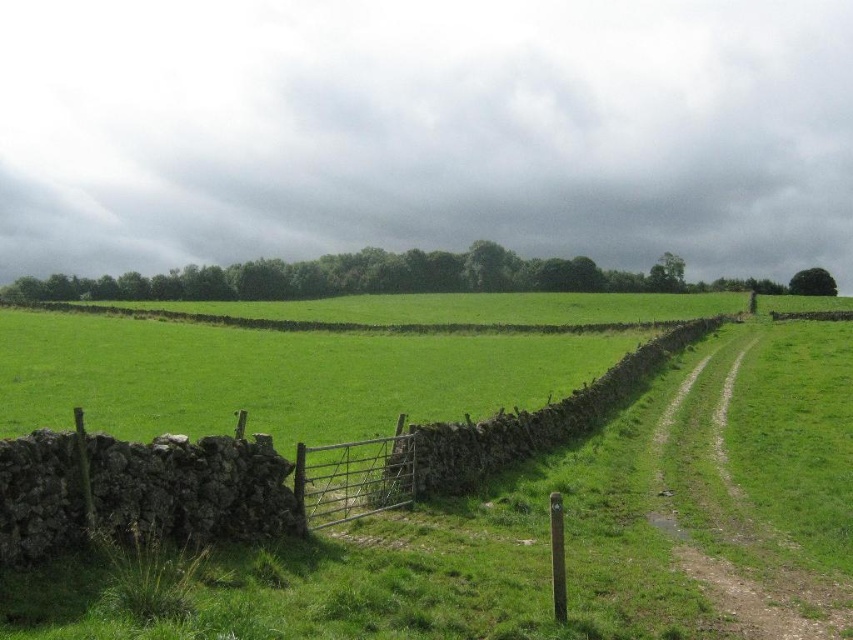
Question: Can you confirm if dusty gravel path at right is thinner than stone wall at center?

Choices:
 (A) yes
 (B) no

Answer: (A)

Question: Observing the image, what is the correct spatial positioning of dusty gravel path at right in reference to stone wall at center?

Choices:
 (A) above
 (B) below

Answer: (B)

Question: Is dusty gravel path at right to the left of stone wall at center from the viewer's perspective?

Choices:
 (A) yes
 (B) no

Answer: (B)